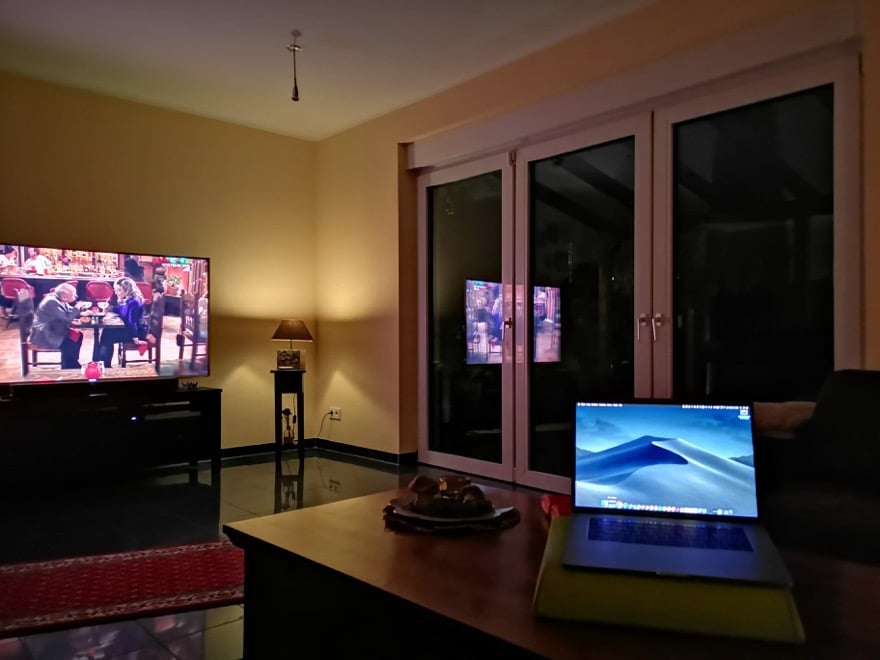
Locate an element on the screen. laptop is located at coordinates (657, 455).